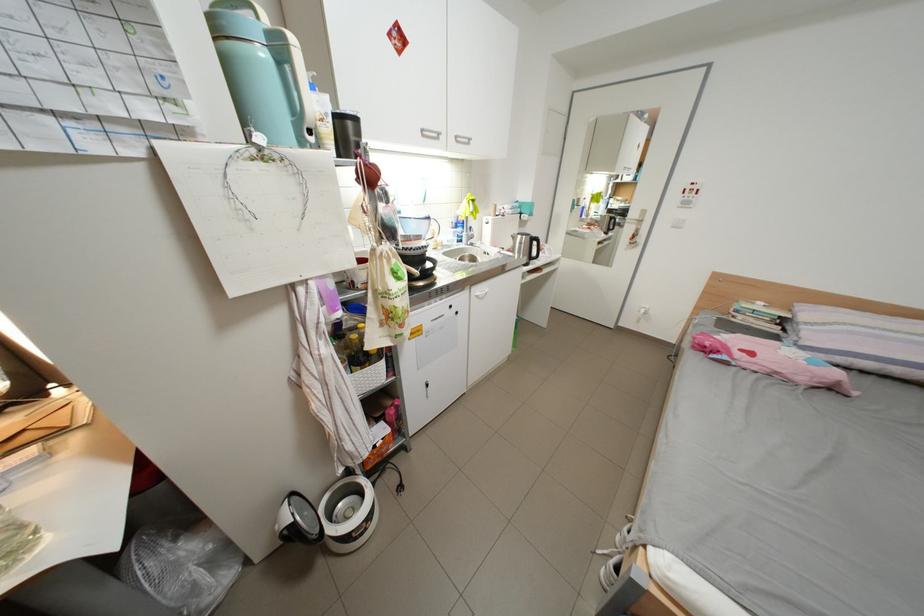
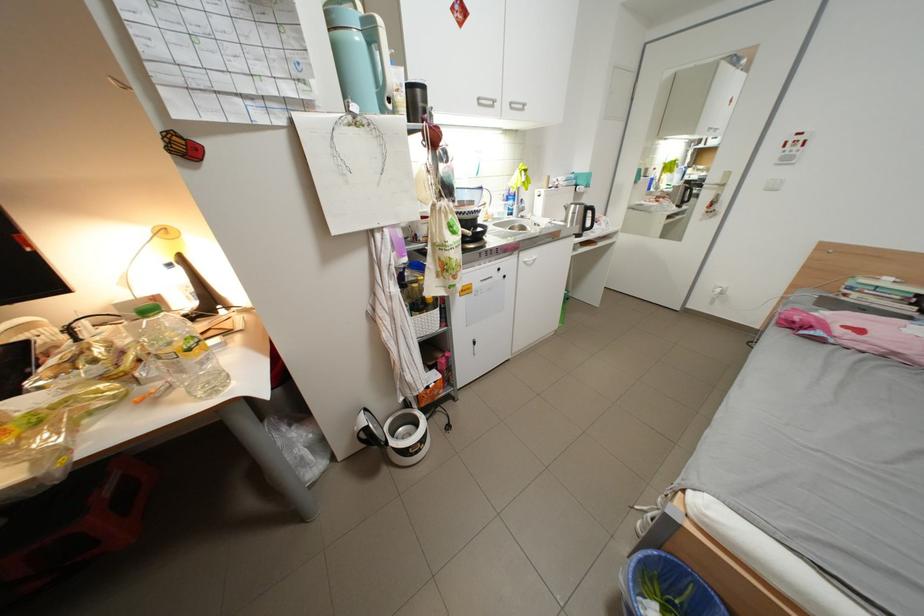
Locate, in the second image, the point that corresponds to pixel 468 139 in the first image.

(523, 105)